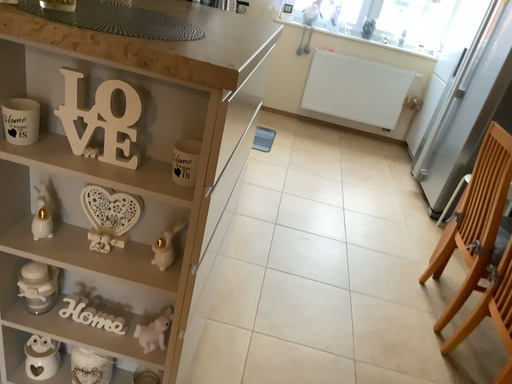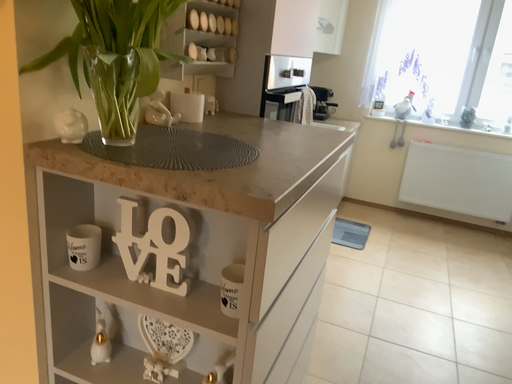
Question: Which way did the camera rotate in the video?

Choices:
 (A) rotated upward
 (B) rotated downward

Answer: (A)